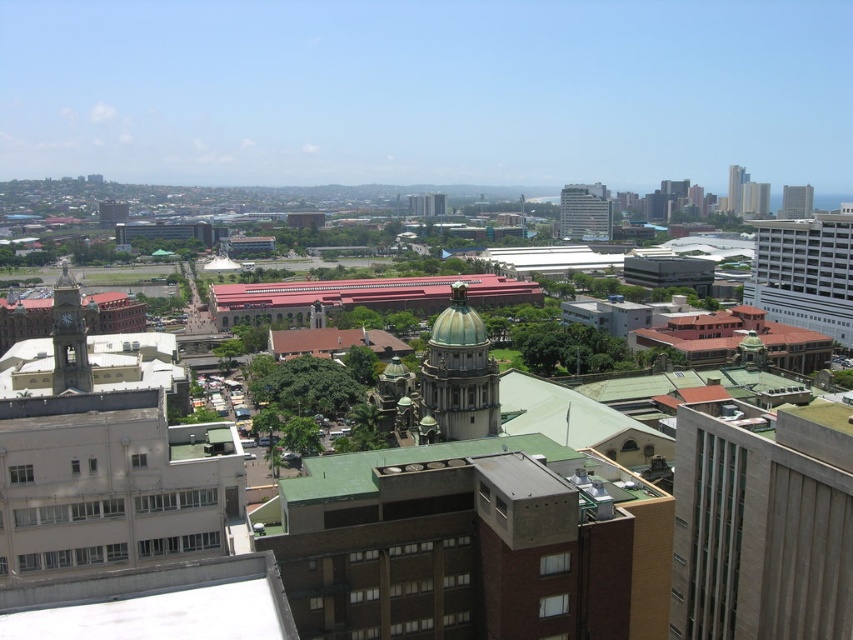
You are a city planner reviewing the aerial view of the city. You notice the matte gray skyscraper at upper right and the glassy reflective skyscraper at upper right. Which one has a larger footprint in terms of width?

The matte gray skyscraper at upper right might be wider than the glassy reflective skyscraper at upper right according to the description.

In the scene shown: You are a city planner reviewing this area. You need to decide where to place a new satellite dish that requires a clear line of sight to the sky. Which building would you choose, the green dome building at center or the matte glass building at center, and why?

The matte glass building at center is taller than the green dome building at center. Therefore, placing the satellite dish on the matte glass building at center would provide a better clear line of sight to the sky because of its height advantage.

You are a drone operator trying to navigate between the matte gray clock tower at left and the matte gray skyscraper at upper right. Which direction should you fly to move from the clock tower to the skyscraper?

To move from the matte gray clock tower at left to the matte gray skyscraper at upper right, you should fly towards the upper right direction since the skyscraper is located at upper right relative to the clock tower.